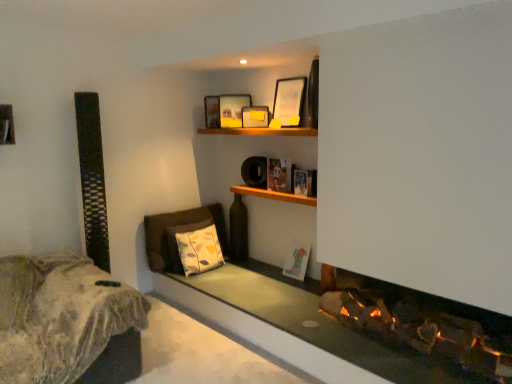
Question: Is matte white picture frame at lower center, the 1th picture frame when ordered from bottom to top, to the right of wooden shelf at center from the viewer's perspective?

Choices:
 (A) yes
 (B) no

Answer: (A)

Question: From the image's perspective, is matte white picture frame at lower center, which is counted as the fourth picture frame, starting from the top, on wooden shelf at center?

Choices:
 (A) no
 (B) yes

Answer: (A)

Question: Is matte white picture frame at lower center, the 1th picture frame when ordered from bottom to top, at the left side of wooden shelf at center?

Choices:
 (A) no
 (B) yes

Answer: (A)

Question: Would you consider matte white picture frame at lower center, which is counted as the fourth picture frame, starting from the top, to be distant from wooden shelf at center?

Choices:
 (A) no
 (B) yes

Answer: (A)

Question: From a real-world perspective, is matte white picture frame at lower center, which is counted as the fourth picture frame, starting from the top, under wooden shelf at center?

Choices:
 (A) yes
 (B) no

Answer: (A)

Question: Considering the positions of yellow-patterned fabric pillow at lower center and matte wooden picture frame at upper center, the 4th picture frame in the bottom-to-top sequence, in the image, is yellow-patterned fabric pillow at lower center taller or shorter than matte wooden picture frame at upper center, the 4th picture frame in the bottom-to-top sequence,?

Choices:
 (A) short
 (B) tall

Answer: (B)

Question: Is point (182, 249) closer or farther from the camera than point (286, 112)?

Choices:
 (A) farther
 (B) closer

Answer: (A)

Question: Would you say yellow-patterned fabric pillow at lower center is inside or outside matte wooden picture frame at upper center, the 4th picture frame in the bottom-to-top sequence?

Choices:
 (A) inside
 (B) outside

Answer: (B)

Question: In terms of width, does yellow-patterned fabric pillow at lower center look wider or thinner when compared to matte wooden picture frame at upper center, which is the first picture frame in top-to-bottom order?

Choices:
 (A) wide
 (B) thin

Answer: (A)

Question: Is point (62, 296) closer or farther from the camera than point (284, 132)?

Choices:
 (A) farther
 (B) closer

Answer: (B)

Question: From the image's perspective, is fuzzy fabric bed at lower left located above or below wooden shelf at upper center?

Choices:
 (A) above
 (B) below

Answer: (B)

Question: From a real-world perspective, is fuzzy fabric bed at lower left positioned above or below wooden shelf at upper center?

Choices:
 (A) above
 (B) below

Answer: (B)

Question: Is fuzzy fabric bed at lower left to the left or to the right of wooden shelf at upper center in the image?

Choices:
 (A) right
 (B) left

Answer: (B)

Question: From the image's perspective, is matte white picture frame at lower center, which is counted as the fourth picture frame, starting from the top, located above or below fuzzy fabric bed at lower left?

Choices:
 (A) below
 (B) above

Answer: (B)

Question: From a real-world perspective, relative to fuzzy fabric bed at lower left, is matte white picture frame at lower center, which is counted as the fourth picture frame, starting from the top, vertically above or below?

Choices:
 (A) below
 (B) above

Answer: (B)